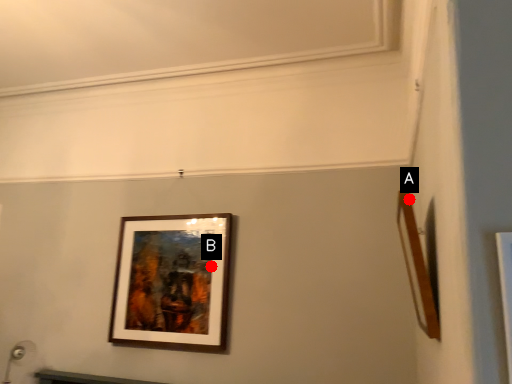
Question: Two points are circled on the image, labeled by A and B beside each circle. Among these points, which one is nearest to the camera?

Choices:
 (A) A is closer
 (B) B is closer

Answer: (A)